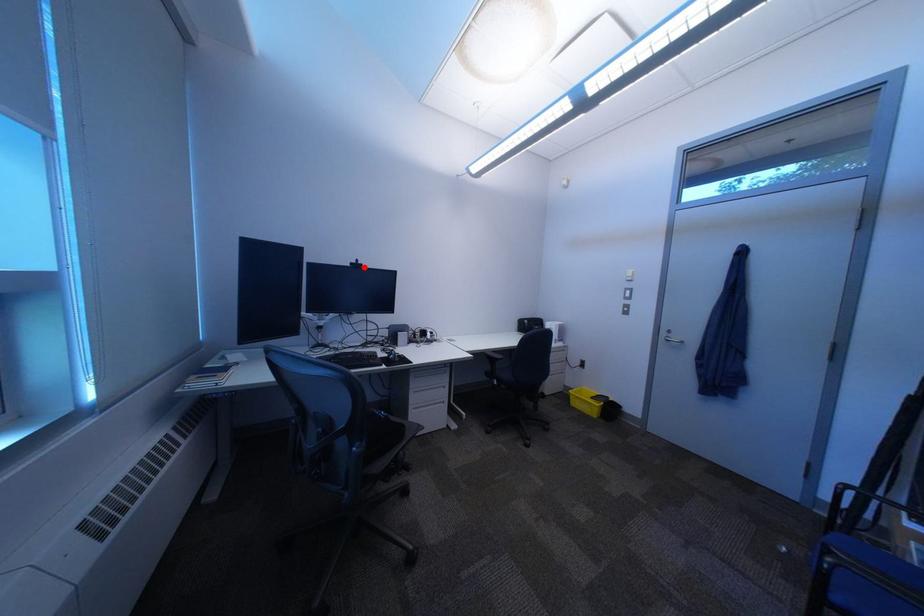
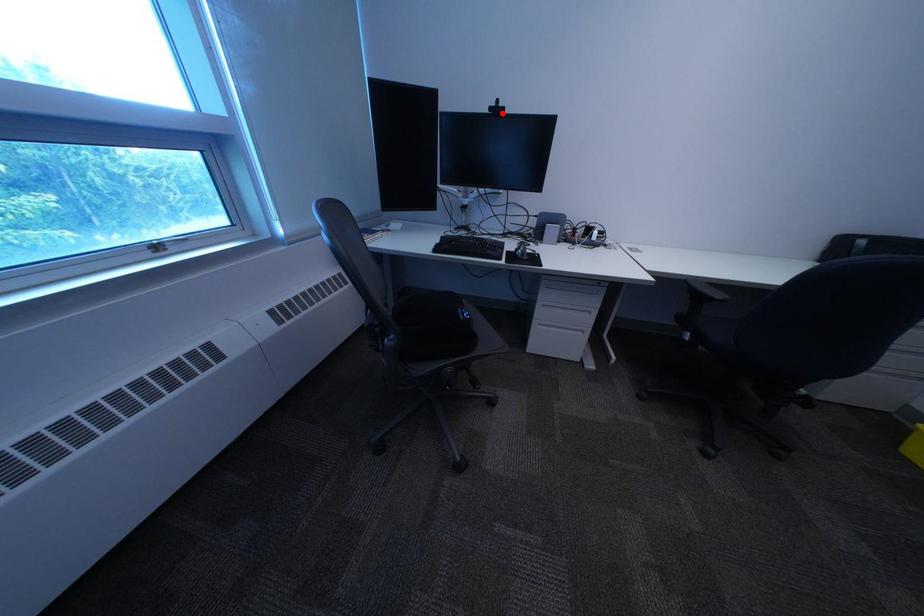
I am providing you with two images of the same scene from different viewpoints. A red point is marked on the first image and another point is marked on the second image. Are the points marked in image1 and image2 representing the same 3D position?

Yes